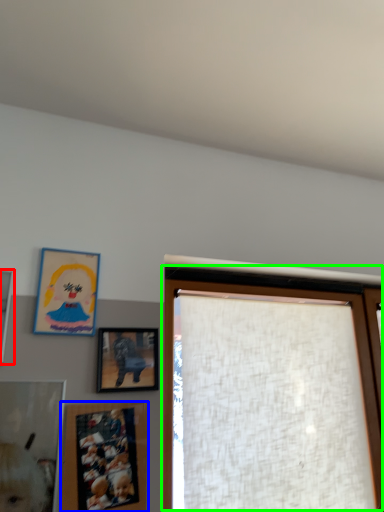
Question: Which is nearer to the picture frame (highlighted by a red box)? picture frame (highlighted by a blue box) or window (highlighted by a green box).

Choices:
 (A) picture frame
 (B) window

Answer: (A)